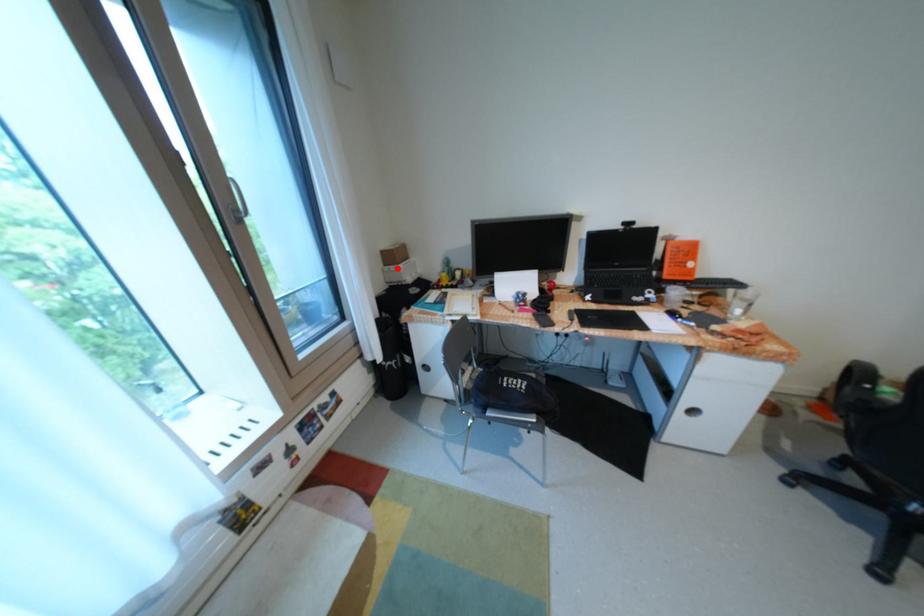
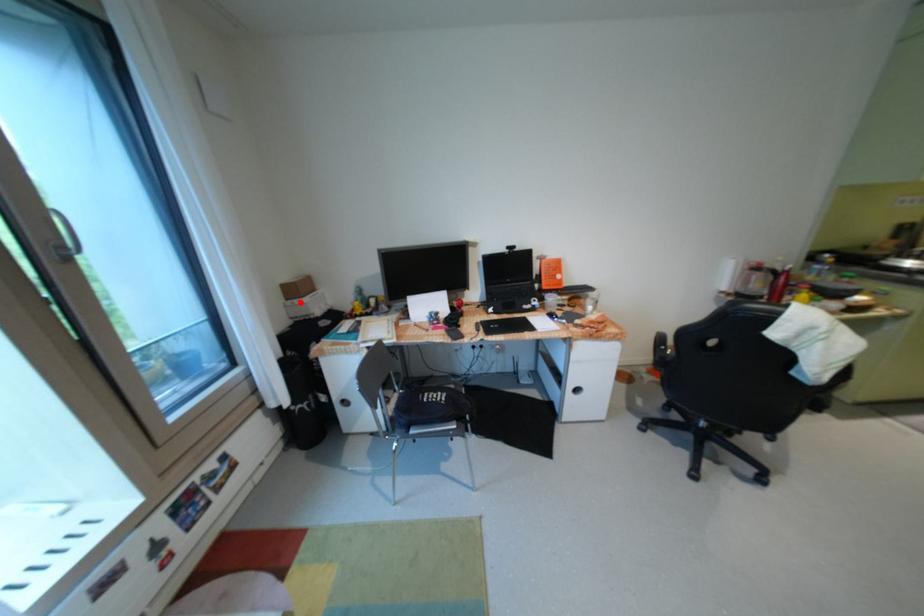
I am providing you with two images of the same scene from different viewpoints. A red point is marked on the first image and another point is marked on the second image. Is the marked point in image1 the same physical position as the marked point in image2?

Yes